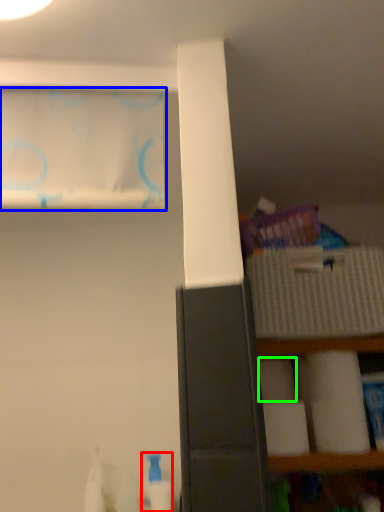
Question: Estimate the real-world distances between objects in this image. Which object is closer to cleaning product (highlighted by a red box), curtain (highlighted by a blue box) or toilet paper (highlighted by a green box)?

Choices:
 (A) curtain
 (B) toilet paper

Answer: (B)